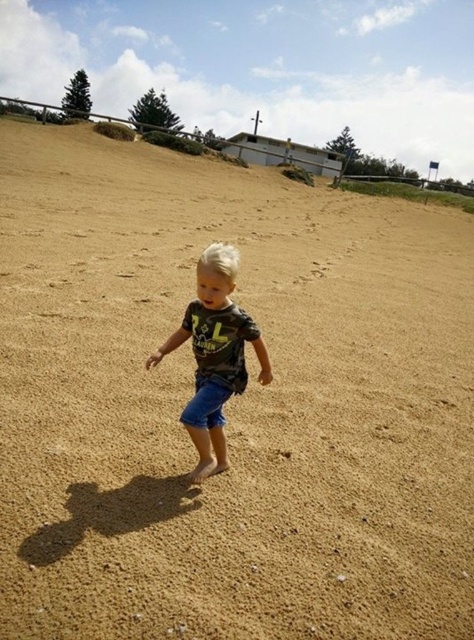
Question: Can you confirm if matte black t-shirt at center is bigger than blue denim shorts at center?

Choices:
 (A) no
 (B) yes

Answer: (B)

Question: Which point is farther to the camera?

Choices:
 (A) (200, 371)
 (B) (192, 404)

Answer: (A)

Question: Is matte black t-shirt at center smaller than blue denim shorts at center?

Choices:
 (A) no
 (B) yes

Answer: (A)

Question: Does matte black t-shirt at center appear under blue denim shorts at center?

Choices:
 (A) yes
 (B) no

Answer: (B)